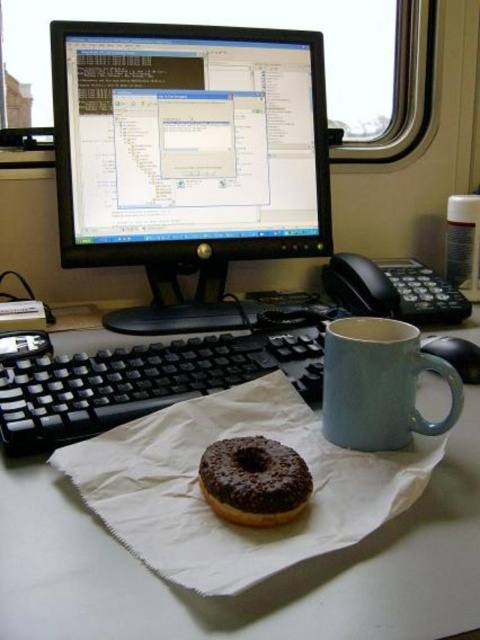
Question: Is chocolate-coated donut at center to the left of black plastic phone at right from the viewer's perspective?

Choices:
 (A) no
 (B) yes

Answer: (B)

Question: Among these objects, which one is farthest from the camera?

Choices:
 (A) matte blue mug at right
 (B) black plastic keyboard at center

Answer: (B)

Question: Estimate the real-world distances between objects in this image. Which object is closer to the black plastic keyboard at center?

Choices:
 (A) white paper at center
 (B) black plastic phone at right
 (C) matte blue mug at right
 (D) chocolate-coated donut at center

Answer: (A)

Question: Which object appears farthest from the camera in this image?

Choices:
 (A) black plastic keyboard at center
 (B) chocolate-coated donut at center
 (C) black glossy monitor at upper center

Answer: (C)

Question: Can you confirm if black glossy monitor at upper center is positioned to the right of matte blue mug at right?

Choices:
 (A) no
 (B) yes

Answer: (A)

Question: Can you confirm if white paper at center is positioned below black plastic phone at right?

Choices:
 (A) no
 (B) yes

Answer: (B)